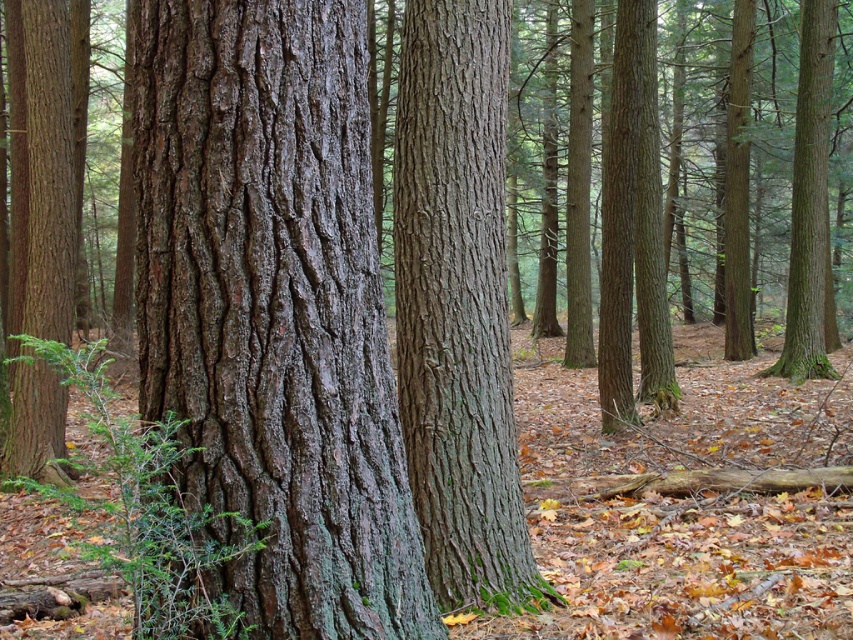
Who is more forward, [392,609] or [451,173]?

Point [392,609] is in front.

Is point (245, 368) closer to camera compared to point (445, 275)?

That is True.

Is point (364, 612) more distant than point (439, 420)?

No, (364, 612) is closer to viewer.

The width and height of the screenshot is (853, 640). I want to click on dark brown rough bark at center, so click(274, 308).

Is smooth bark tree trunk at center shorter than smooth brown tree trunk at right?

No.

Is point (502, 324) in front of point (827, 228)?

Yes, it is in front of point (827, 228).

This screenshot has width=853, height=640. What are the coordinates of `smooth bark tree trunk at center` in the screenshot? It's located at (457, 305).

Does smooth brown bark at left have a lesser width compared to smooth brown tree trunk at right?

Incorrect, smooth brown bark at left's width is not less than smooth brown tree trunk at right's.

Where is `smooth brown bark at left`? Image resolution: width=853 pixels, height=640 pixels. smooth brown bark at left is located at coordinates (44, 170).